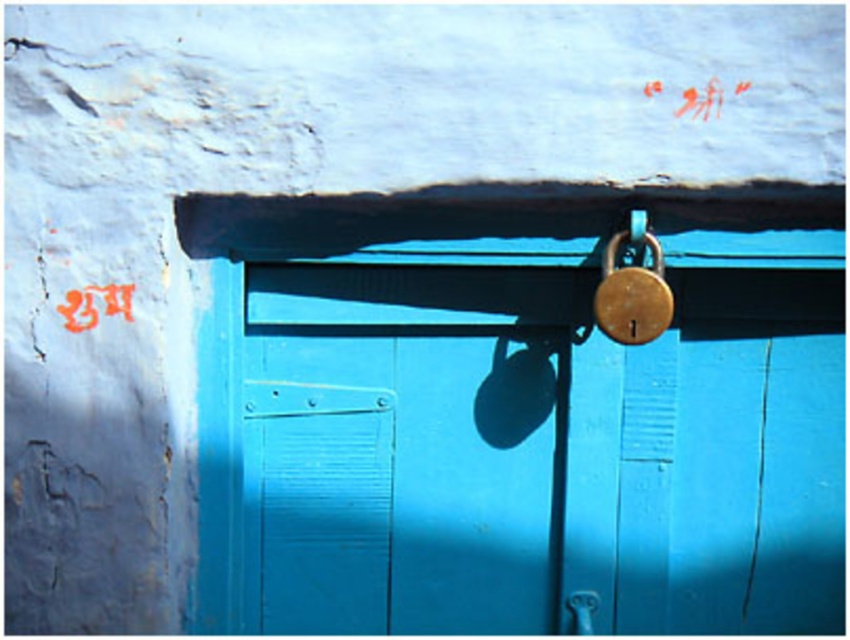
You are trying to open the blue door and notice both the gold metallic padlock at upper center and the polished silver door handle at lower center. Which object is easier to reach without moving your current position?

The gold metallic padlock at upper center is closer to the viewer than the polished silver door handle at lower center, so it is easier to reach without moving.

You are trying to determine which object is larger between the brushed metal lock at center and the polished silver door handle at lower center. Based on the scene, which one has a larger size?

The brushed metal lock at center is bigger than the polished silver door handle at lower center according to the description.

Based on the photo, you are standing in front of the blue door and want to reach the gold metallic padlock at upper center. What are the coordinates of the padlock?

The coordinates of the gold metallic padlock at upper center are at point (632, 292).